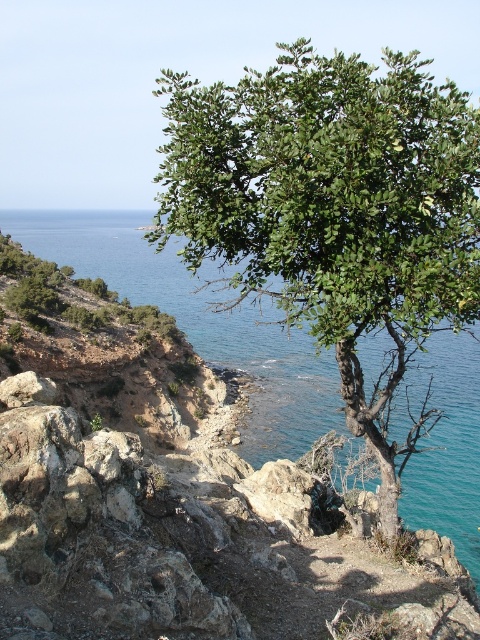
Question: Which of the following is the closest to the observer?

Choices:
 (A) green leafy tree at upper center
 (B) clear blue water at upper right

Answer: (A)

Question: Considering the relative positions of green leafy tree at upper center and clear blue water at upper right in the image provided, where is green leafy tree at upper center located with respect to clear blue water at upper right?

Choices:
 (A) above
 (B) below

Answer: (B)

Question: Considering the relative positions of green leafy tree at upper center and clear blue water at upper right in the image provided, where is green leafy tree at upper center located with respect to clear blue water at upper right?

Choices:
 (A) right
 (B) left

Answer: (A)

Question: Which point is closer to the camera?

Choices:
 (A) clear blue water at upper right
 (B) green leafy tree at upper center

Answer: (B)

Question: Can you confirm if green leafy tree at upper center is positioned to the right of clear blue water at upper right?

Choices:
 (A) no
 (B) yes

Answer: (B)